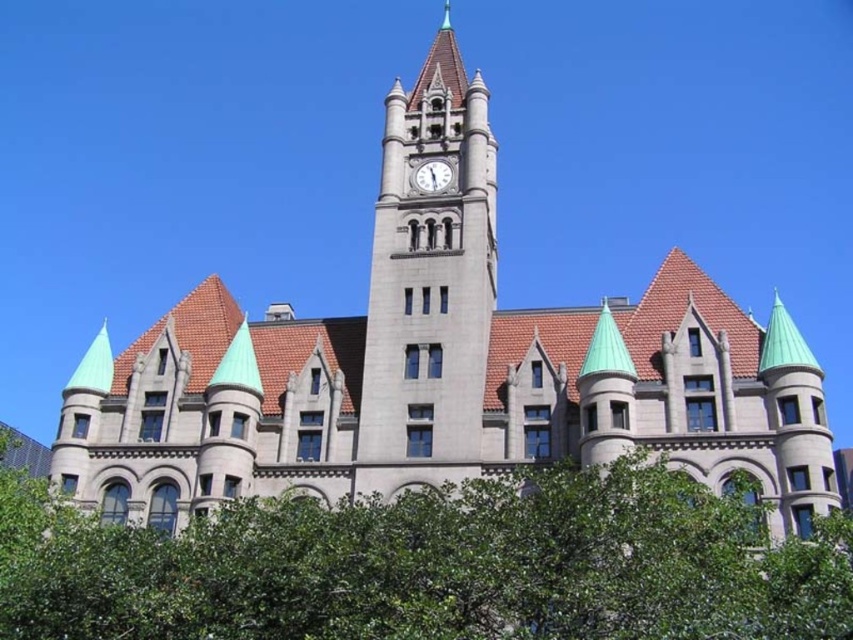
Question: Can you confirm if stone clock tower at center is positioned to the left of white stone clock at center?

Choices:
 (A) no
 (B) yes

Answer: (A)

Question: Which of these objects is positioned closest to the white stone clock at center?

Choices:
 (A) stone clock tower at center
 (B) green leafy tree at lower center

Answer: (A)

Question: Does green leafy tree at lower center appear on the right side of stone clock tower at center?

Choices:
 (A) yes
 (B) no

Answer: (B)

Question: Which object is the closest to the green leafy tree at lower center?

Choices:
 (A) white stone clock at center
 (B) stone clock tower at center

Answer: (B)

Question: Is green leafy tree at lower center thinner than stone clock tower at center?

Choices:
 (A) no
 (B) yes

Answer: (A)

Question: Which of the following is the farthest from the observer?

Choices:
 (A) white stone clock at center
 (B) green leafy tree at lower center

Answer: (A)